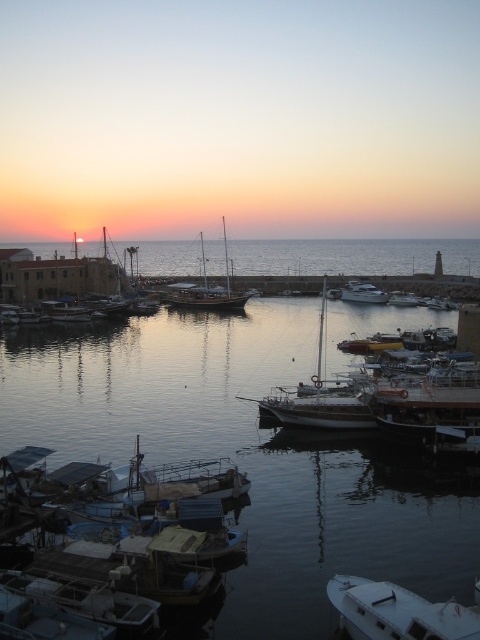
Between point (396, 632) and point (200, 305), which one is positioned in front?

Point (396, 632)

Which is in front, point (447, 621) or point (237, 298)?

Point (447, 621)

Locate an element on the screen. The width and height of the screenshot is (480, 640). white matte boat at lower right is located at coordinates (396, 611).

Who is more distant from viewer, (424, 604) or (309, 401)?

Positioned behind is point (309, 401).

Can you confirm if white matte boat at lower right is taller than white matte sailboat at center?

Incorrect, white matte boat at lower right's height is not larger of white matte sailboat at center's.

Does point (463, 634) lie in front of point (321, 412)?

That is True.

This screenshot has width=480, height=640. What are the coordinates of `white matte boat at lower right` in the screenshot? It's located at (396, 611).

Between blue plastic boat at lower left and wooden sailboat at center, which one has more height?

wooden sailboat at center is taller.

How far apart are blue plastic boat at lower left and wooden sailboat at center?

68.98 meters

The image size is (480, 640). What do you see at coordinates (131, 572) in the screenshot?
I see `blue plastic boat at lower left` at bounding box center [131, 572].

Identify the location of blue plastic boat at lower left. (131, 572).